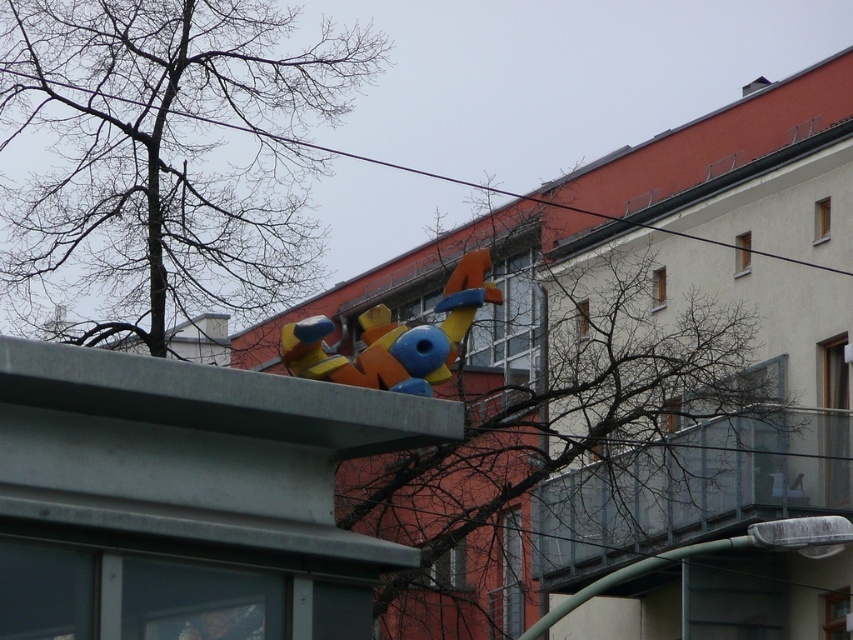
You are standing in front of the building and see the bare branches at upper center and the matte plastic toy at center. Which object is positioned to the right side of the other?

The bare branches at upper center is to the right of the matte plastic toy at center.

You are standing in front of the building and notice the bare branches at upper left and the matte plastic toy at center. Which object is positioned more to the left side of the scene?

The bare branches at upper left is positioned more to the left side of the scene than the matte plastic toy at center.